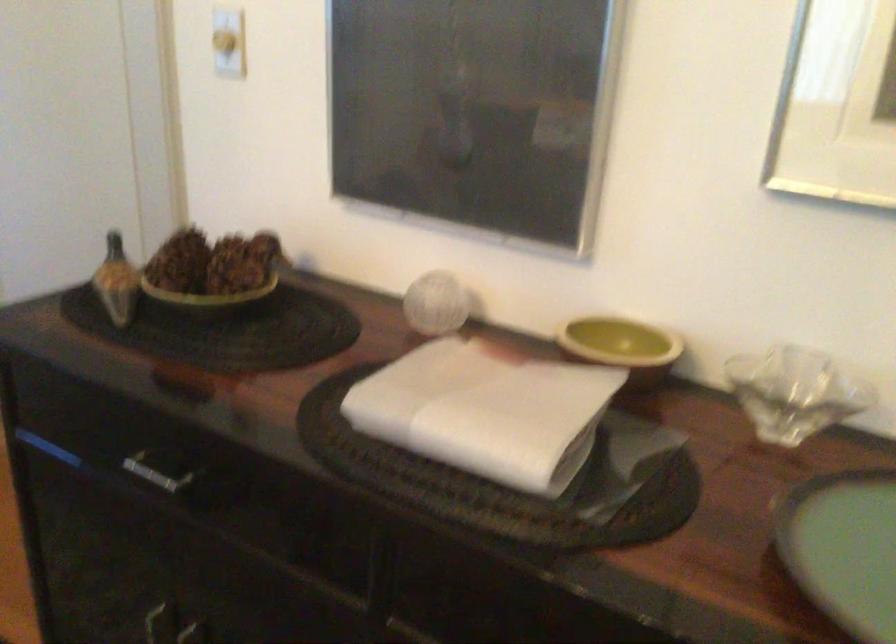
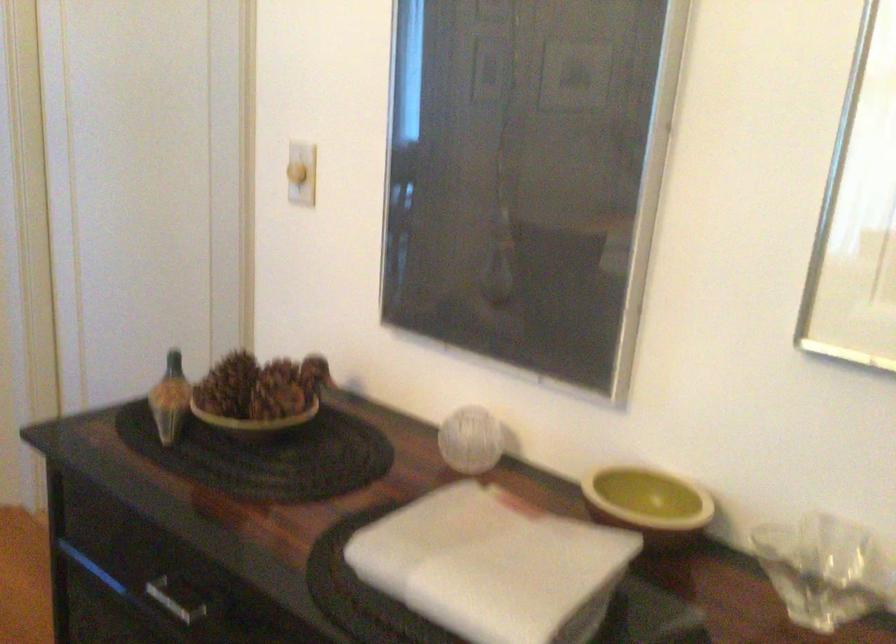
Locate, in the second image, the point that corresponds to the point at 437,303 in the first image.

(470, 440)